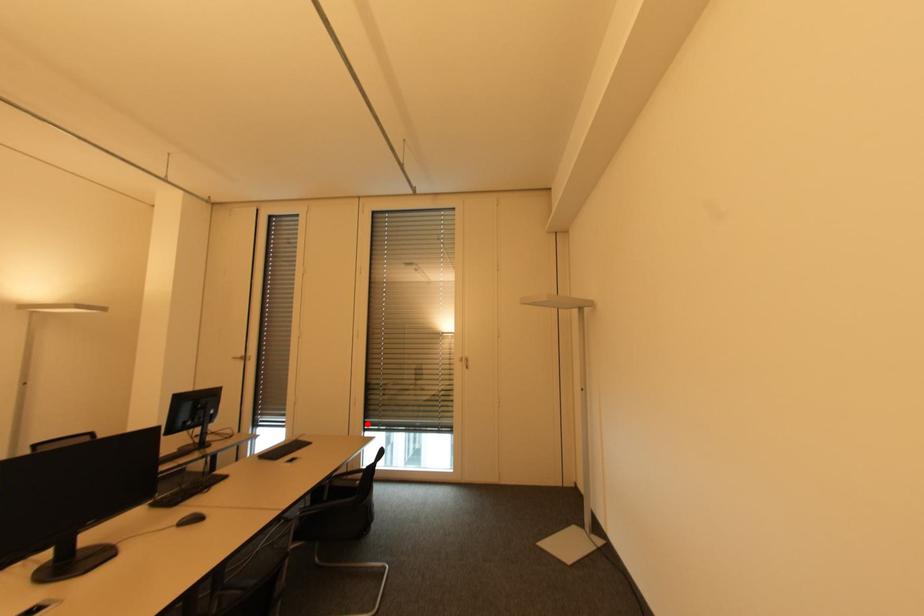
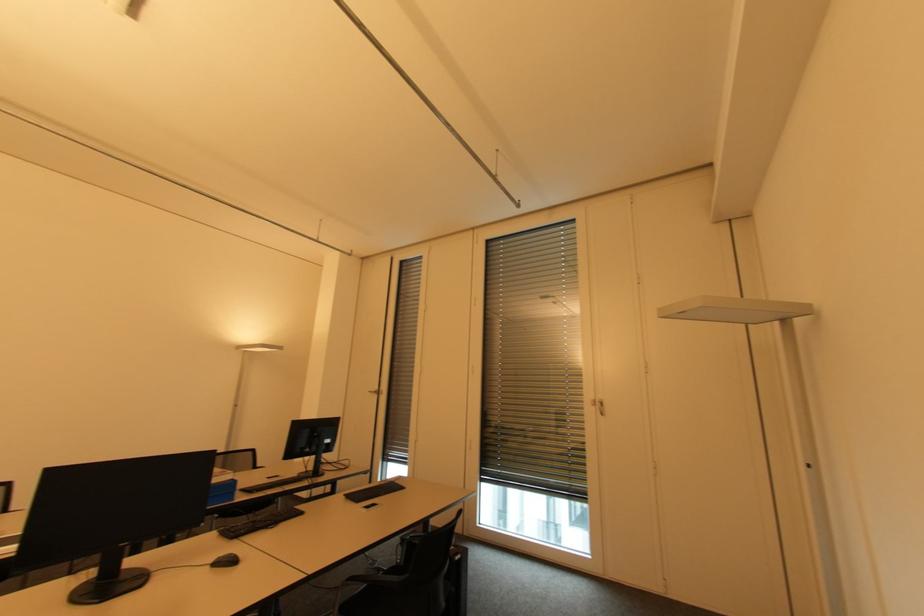
Where in the second image is the point corresponding to the highlighted location from the first image?

(483, 474)